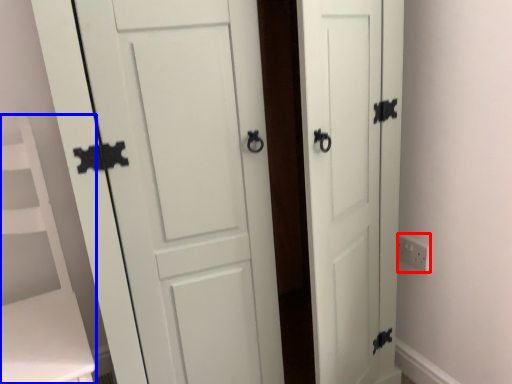
Question: Which object is further to the camera taking this photo, electric outlet (highlighted by a red box) or vanity (highlighted by a blue box)?

Choices:
 (A) electric outlet
 (B) vanity

Answer: (A)